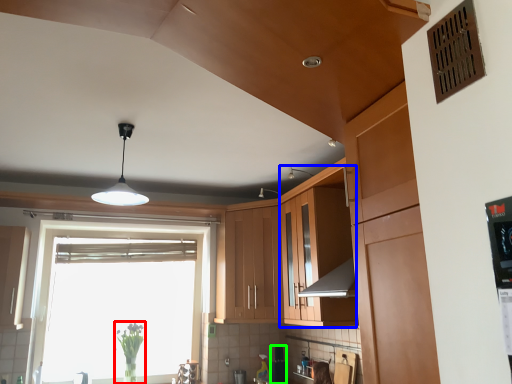
Question: Considering the real-world distances, which object is farthest from plant (highlighted by a red box)? cabinetry (highlighted by a blue box) or appliance (highlighted by a green box)?

Choices:
 (A) cabinetry
 (B) appliance

Answer: (A)